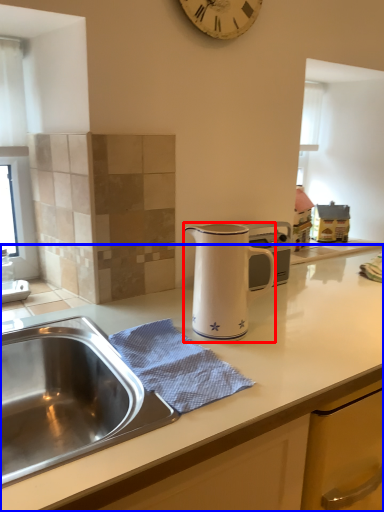
Question: Among these objects, which one is farthest to the camera, jug (highlighted by a red box) or countertop (highlighted by a blue box)?

Choices:
 (A) jug
 (B) countertop

Answer: (A)